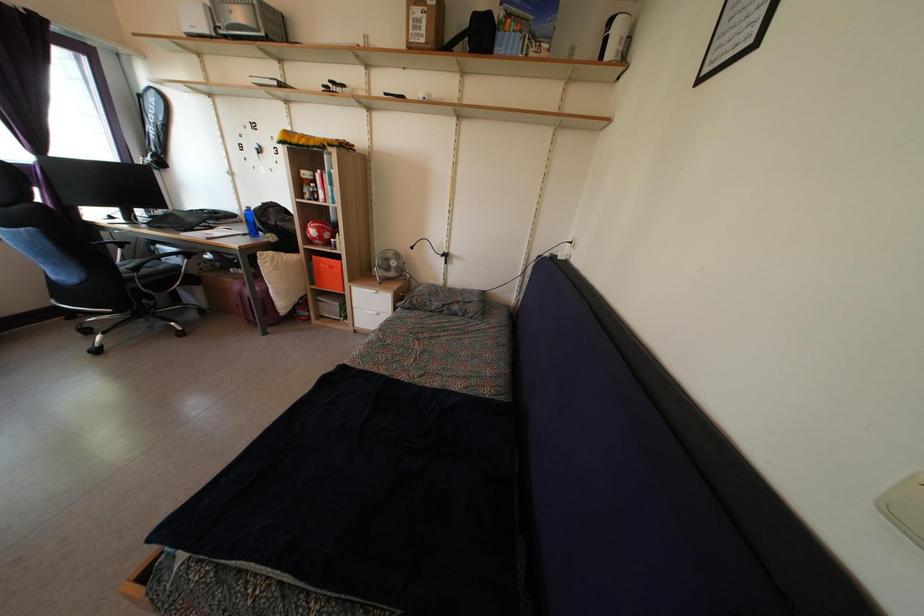
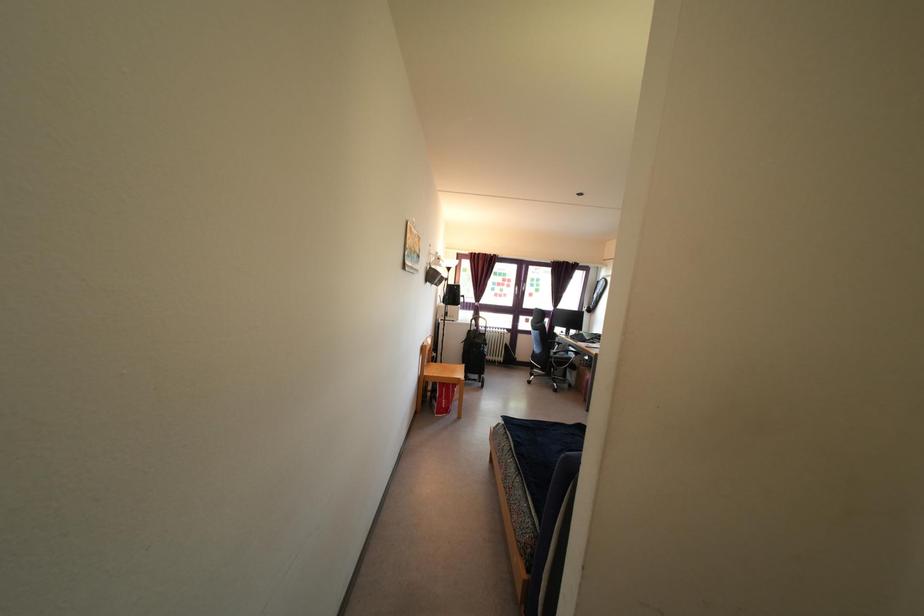
The point at (x=139, y=278) is marked in the first image. Where is the corresponding point in the second image?

(557, 362)